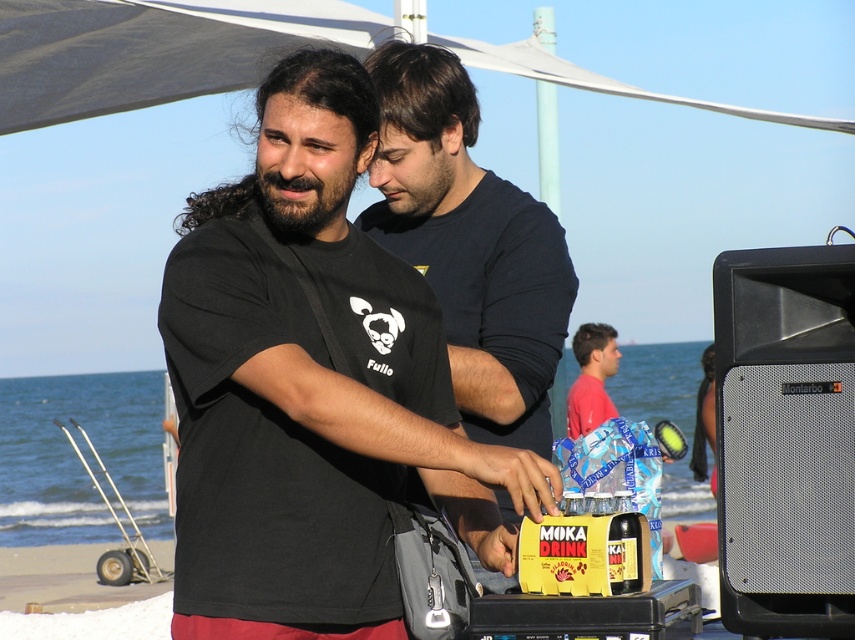
Question: Among these objects, which one is farthest from the camera?

Choices:
 (A) dark brown glass bottle at center
 (B) red matte shirt at center

Answer: (B)

Question: Is black matte t-shirt at center below dark blue t-shirt at center?

Choices:
 (A) yes
 (B) no

Answer: (A)

Question: Does dark blue t-shirt at center have a smaller size compared to dark brown glass bottle at center?

Choices:
 (A) yes
 (B) no

Answer: (B)

Question: Where is black matte t-shirt at center located in relation to dark brown glass bottle at center in the image?

Choices:
 (A) right
 (B) left

Answer: (B)

Question: Based on their relative distances, which object is farther from the black matte t-shirt at center?

Choices:
 (A) dark blue t-shirt at center
 (B) red matte shirt at center
 (C) dark brown glass bottle at center

Answer: (B)

Question: Among these points, which one is farthest from the camera?

Choices:
 (A) click(x=510, y=272)
 (B) click(x=628, y=496)
 (C) click(x=606, y=358)
 (D) click(x=404, y=410)

Answer: (C)